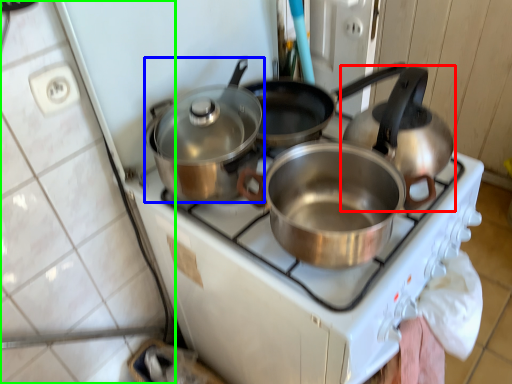
Question: Considering the real-world distances, which object is farthest from kettle (highlighted by a red box)? kitchen appliance (highlighted by a blue box) or tile (highlighted by a green box)?

Choices:
 (A) kitchen appliance
 (B) tile

Answer: (B)